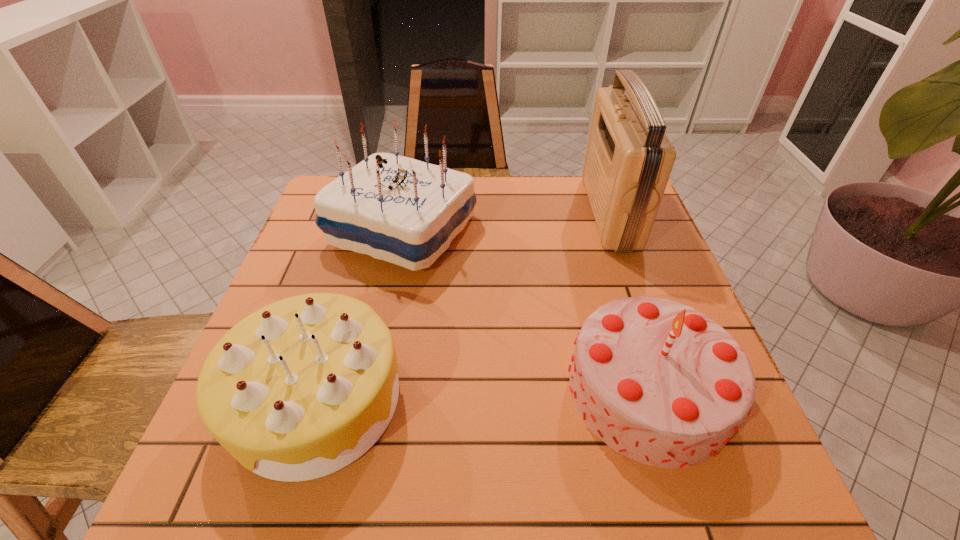
Identify which birthday cake is the second nearest to the shortest birthday cake. Please provide its 2D coordinates. Your answer should be formatted as a tuple, i.e. [(x, y)], where the tuple contains the x and y coordinates of a point satisfying the conditions above.

[(659, 382)]

This screenshot has height=540, width=960. Identify the location of vacant space that satisfies the following two spatial constraints: 1. on the back side of the rightmost birthday cake; 2. on the left side of the shortest object. (320, 390).

I want to click on vacant region that satisfies the following two spatial constraints: 1. on the front-facing side of the radio receiver; 2. on the front side of the third shortest object, so click(x=616, y=232).

Where is `vacant space that satisfies the following two spatial constraints: 1. on the front-facing side of the radio receiver; 2. on the front side of the third shortest object`? This screenshot has width=960, height=540. vacant space that satisfies the following two spatial constraints: 1. on the front-facing side of the radio receiver; 2. on the front side of the third shortest object is located at coordinates (616, 232).